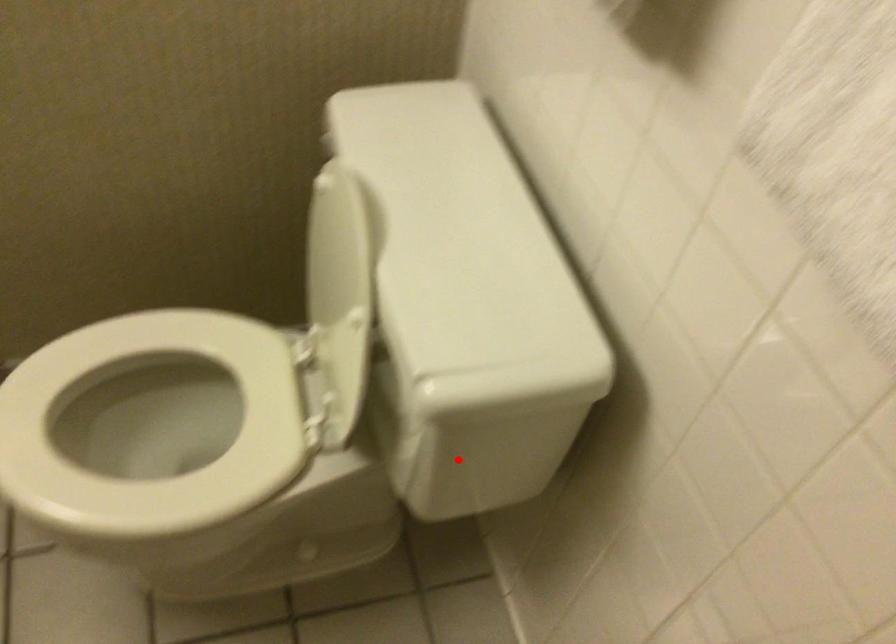
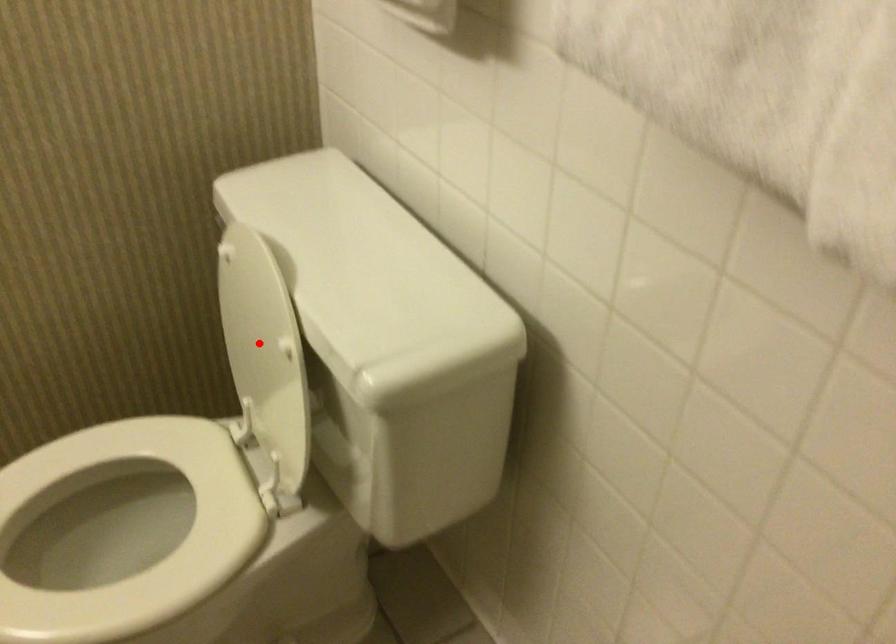
I am providing you with two images of the same scene from different viewpoints. A red point is marked on the first image and another point is marked on the second image. Is the red point in image1 aligned with the point shown in image2?

No